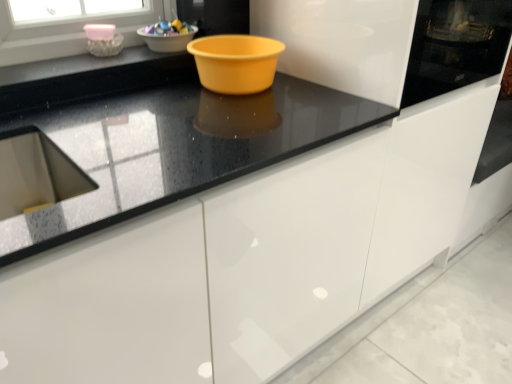
In order to click on vacant space to the right of pink glass bowl at upper left, which is the first basin in left-to-right order in this screenshot , I will do `click(138, 56)`.